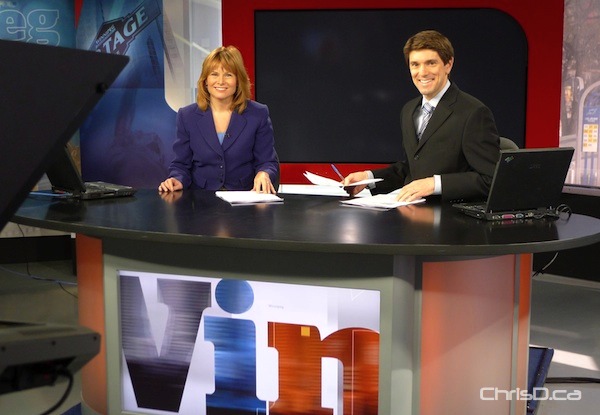
You are a GUI agent. You are given a task and a screenshot of the screen. Output one action in this format:
    pyautogui.click(x=<x>, y=<y>)
    Task: Click on the laptop
    The width and height of the screenshot is (600, 415).
    Given the screenshot: What is the action you would take?
    (519, 193)